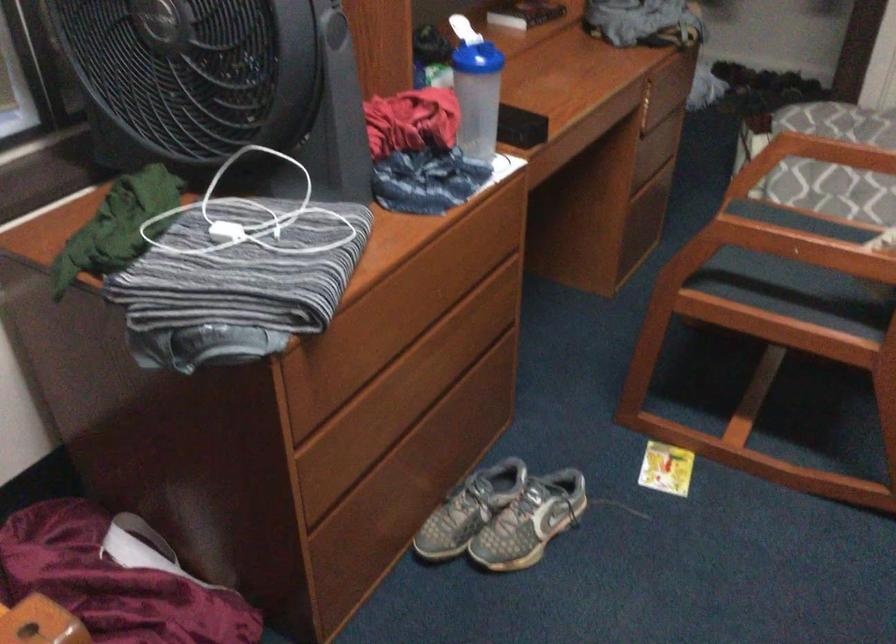
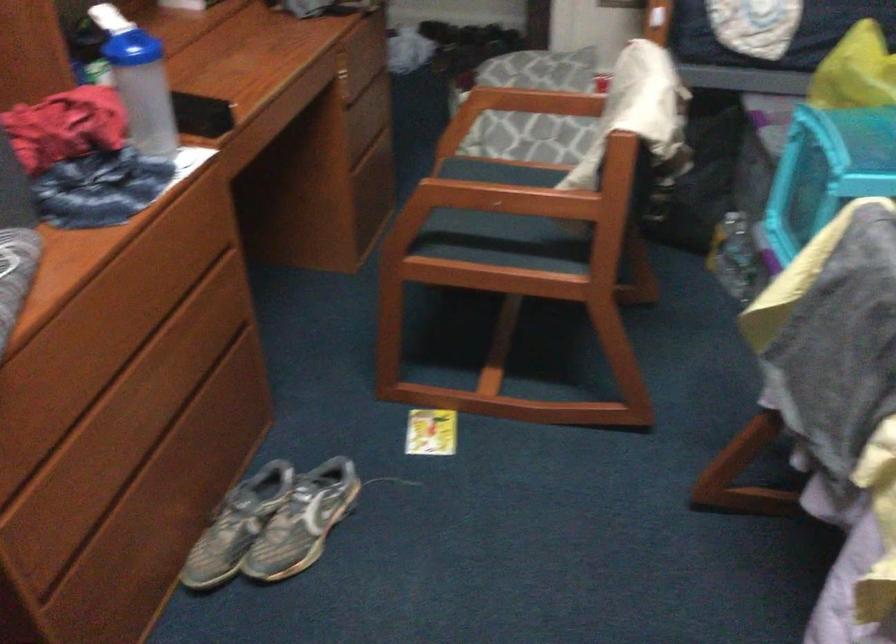
Question: What movement of the cameraman would produce the second image?

Choices:
 (A) Left
 (B) Right
 (C) Forward
 (D) Backward

Answer: (B)